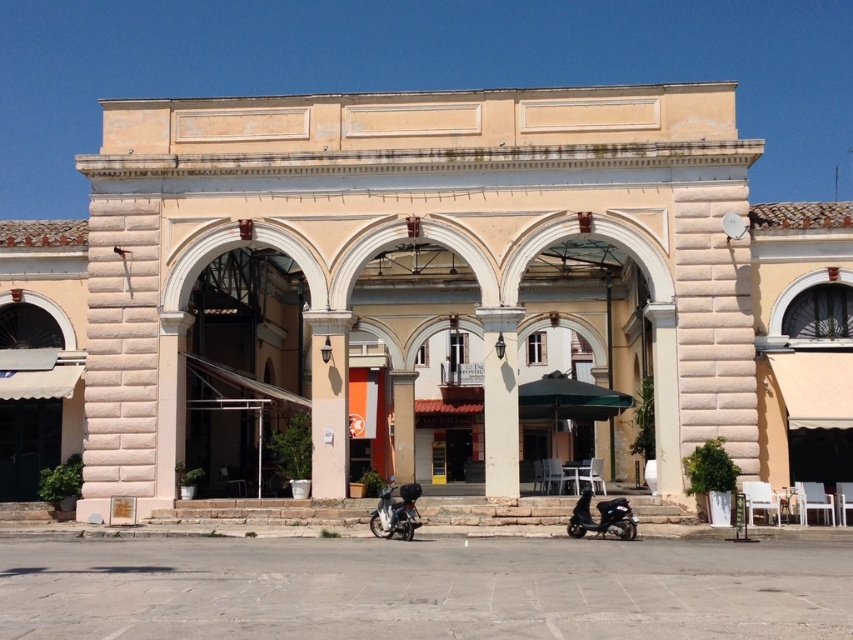
Question: Does green fabric umbrella at center have a lesser width compared to shiny black scooter at lower center?

Choices:
 (A) no
 (B) yes

Answer: (A)

Question: From the image, what is the correct spatial relationship of green fabric umbrella at center in relation to metallic silver scooter at center?

Choices:
 (A) right
 (B) left

Answer: (A)

Question: Which is nearer to the green fabric umbrella at center?

Choices:
 (A) white stone column at center
 (B) shiny black scooter at lower center
 (C) metallic silver scooter at center

Answer: (A)

Question: Does green fabric umbrella at center have a larger size compared to shiny black scooter at lower center?

Choices:
 (A) no
 (B) yes

Answer: (B)

Question: Which is nearer to the white stone column at center?

Choices:
 (A) metallic silver scooter at center
 (B) shiny black scooter at lower center
 (C) green fabric umbrella at center

Answer: (C)

Question: Among these points, which one is nearest to the camera?

Choices:
 (A) (592, 412)
 (B) (589, 520)
 (C) (410, 513)
 (D) (503, 476)

Answer: (C)